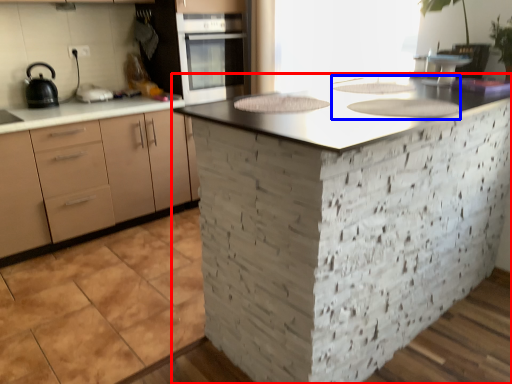
Question: Among these objects, which one is farthest to the camera, countertop (highlighted by a red box) or sink (highlighted by a blue box)?

Choices:
 (A) countertop
 (B) sink

Answer: (B)